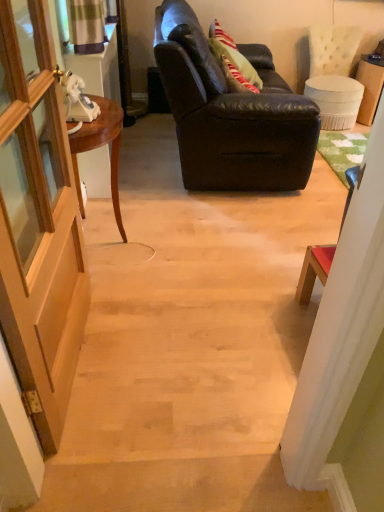
In the scene shown: In order to face green textured curtain at upper left, should I rotate leftwards or rightwards?

To align with it, rotate left about 12.869°.

What do you see at coordinates (231, 113) in the screenshot? This screenshot has height=512, width=384. I see `leather couch at upper center` at bounding box center [231, 113].

I want to click on green textured curtain at upper left, so click(x=87, y=26).

Which of these two, mahogany wood desk at left or green textured curtain at upper left, is thinner?

With smaller width is green textured curtain at upper left.

From the image's perspective, is mahogany wood desk at left positioned above or below green textured curtain at upper left?

From the image's perspective, mahogany wood desk at left appears below green textured curtain at upper left.

Can you confirm if leather couch at upper center is bigger than wooden door at left?

Yes.

Is leather couch at upper center inside the boundaries of wooden door at left, or outside?

A: leather couch at upper center cannot be found inside wooden door at left.

Are leather couch at upper center and wooden door at left beside each other?

There is a gap between leather couch at upper center and wooden door at left.

Looking at this image, from the image's perspective, which object appears higher, leather couch at upper center or wooden door at left?

From the image's view, leather couch at upper center is above.

How different are the orientations of leather couch at upper center and green textured curtain at upper left in degrees?

0.251 degrees separate the facing orientations of leather couch at upper center and green textured curtain at upper left.

Does leather couch at upper center have a larger size compared to green textured curtain at upper left?

Yes, leather couch at upper center is bigger than green textured curtain at upper left.

Is the position of leather couch at upper center more distant than that of green textured curtain at upper left?

No, it is in front of green textured curtain at upper left.

How much distance is there between leather couch at upper center and green textured curtain at upper left?

They are 30.99 inches apart.

Does wooden door at left lie behind green textured curtain at upper left?

No, it is not.

Consider the image. Is wooden door at left taller than green textured curtain at upper left?

Yes.

I want to click on door on the right of green textured curtain at upper left, so click(x=38, y=227).

Where is `studio couch to the right of mahogany wood desk at left`? studio couch to the right of mahogany wood desk at left is located at coordinates (231, 113).

Based on the photo, between leather couch at upper center and mahogany wood desk at left, which one appears on the left side from the viewer's perspective?

mahogany wood desk at left is more to the left.

Measure the distance between leather couch at upper center and mahogany wood desk at left.

32.22 inches.

Which is farther from the camera, (258, 143) or (70, 137)?

Positioned behind is point (258, 143).

The height and width of the screenshot is (512, 384). Find the location of `curtain above the wooden door at left (from a real-world perspective)`. curtain above the wooden door at left (from a real-world perspective) is located at coordinates (87, 26).

Does green textured curtain at upper left lie in front of wooden door at left?

No, it is behind wooden door at left.

Are green textured curtain at upper left and wooden door at left located far from each other?

Yes, green textured curtain at upper left and wooden door at left are located far from each other.

From the picture: From the image's perspective, between green textured curtain at upper left and wooden door at left, which one is located above?

green textured curtain at upper left.

How many degrees apart are the facing directions of wooden door at left and mahogany wood desk at left?

0.342 degrees.

Is wooden door at left with mahogany wood desk at left?

They are not placed beside each other.

Which is closer, (44, 394) or (105, 130)?

The point (44, 394) is in front.

From their relative heights in the image, would you say wooden door at left is taller or shorter than mahogany wood desk at left?

wooden door at left is taller than mahogany wood desk at left.

The height and width of the screenshot is (512, 384). Identify the location of curtain on the left of mahogany wood desk at left. (87, 26).

In order to click on door in front of the leather couch at upper center in this screenshot , I will do tap(38, 227).

When comparing their distances from green textured curtain at upper left, does leather couch at upper center or mahogany wood desk at left seem further?

leather couch at upper center lies further to green textured curtain at upper left than the other object.

Based on their spatial positions, is leather couch at upper center or wooden door at left closer to green textured curtain at upper left?

leather couch at upper center.

Estimate the real-world distances between objects in this image. Which object is further from mahogany wood desk at left, wooden door at left or green textured curtain at upper left?

green textured curtain at upper left lies further to mahogany wood desk at left than the other object.

Which object lies further to the anchor point leather couch at upper center, mahogany wood desk at left or wooden door at left?

Among the two, wooden door at left is located further to leather couch at upper center.

Considering their positions, is leather couch at upper center positioned closer to wooden door at left than mahogany wood desk at left?

mahogany wood desk at left is positioned closer to the anchor wooden door at left.

When comparing their distances from mahogany wood desk at left, does leather couch at upper center or green textured curtain at upper left seem closer?

green textured curtain at upper left lies closer to mahogany wood desk at left than the other object.

Based on their spatial positions, is wooden door at left or mahogany wood desk at left closer to leather couch at upper center?

Among the two, mahogany wood desk at left is located nearer to leather couch at upper center.

Which object lies further to the anchor point mahogany wood desk at left, green textured curtain at upper left or leather couch at upper center?

leather couch at upper center is positioned further to the anchor mahogany wood desk at left.

Locate an element on the screen. The image size is (384, 512). studio couch between wooden door at left and green textured curtain at upper left from front to back is located at coordinates (231, 113).

At what (x,y) coordinates should I click in order to perform the action: click on desk located between wooden door at left and leather couch at upper center in the depth direction. Please return your answer as a coordinate pair (x, y). The height and width of the screenshot is (512, 384). Looking at the image, I should click on (100, 146).

Where is `studio couch between green textured curtain at upper left and mahogany wood desk at left in the up-down direction`? studio couch between green textured curtain at upper left and mahogany wood desk at left in the up-down direction is located at coordinates (231, 113).

Where is `desk between wooden door at left and green textured curtain at upper left in the front-back direction`? This screenshot has height=512, width=384. desk between wooden door at left and green textured curtain at upper left in the front-back direction is located at coordinates (100, 146).